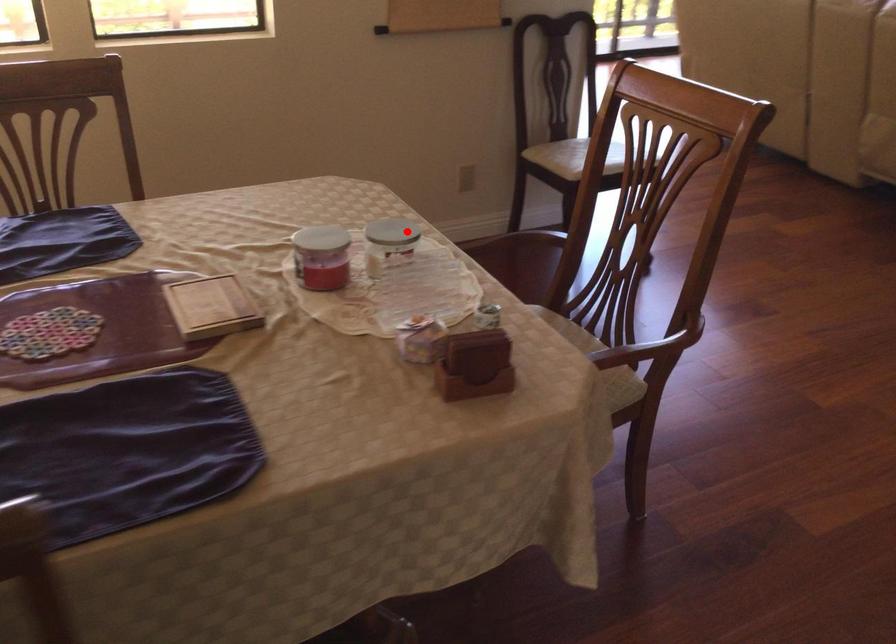
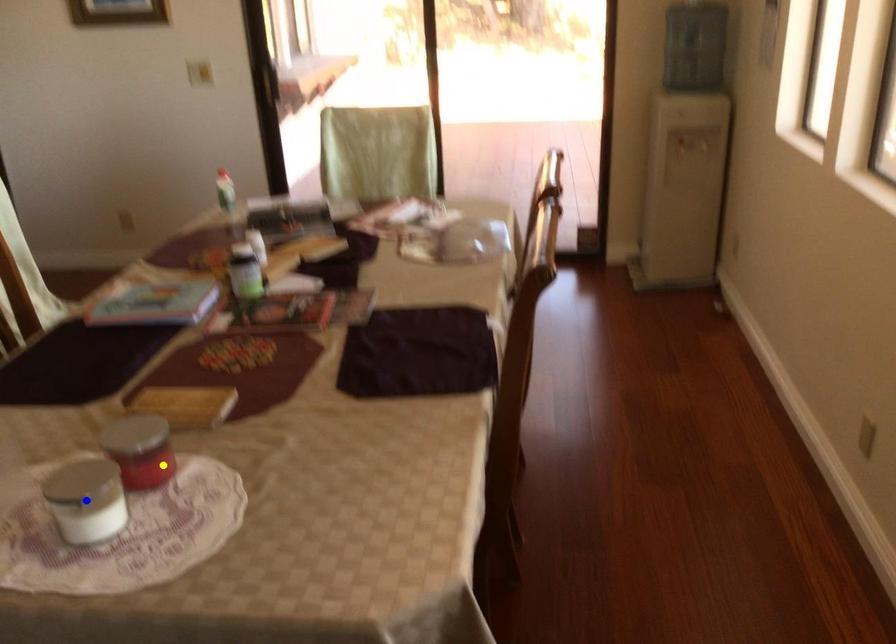
Question: I am providing you with two images of the same scene from different viewpoints. A red point is marked on the first image. You are given multiple points on the second image. Which spot in image 2 lines up with the point in image 1?

Choices:
 (A) green point
 (B) blue point
 (C) yellow point

Answer: (A)